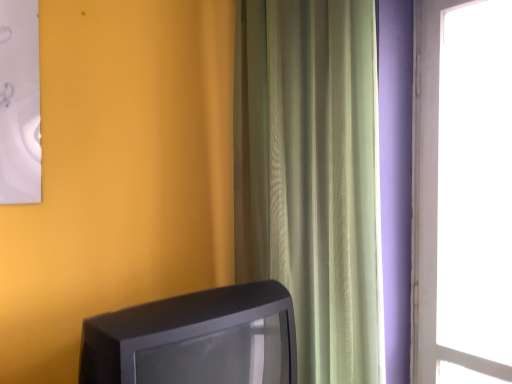
Question: From a real-world perspective, is green textured curtain at center under matte black television at lower left?

Choices:
 (A) yes
 (B) no

Answer: (B)

Question: Can you confirm if green textured curtain at center is positioned to the left of matte black television at lower left?

Choices:
 (A) no
 (B) yes

Answer: (A)

Question: Is green textured curtain at center positioned beyond the bounds of matte black television at lower left?

Choices:
 (A) no
 (B) yes

Answer: (B)

Question: Could matte black television at lower left be considered to be inside green textured curtain at center?

Choices:
 (A) no
 (B) yes

Answer: (A)

Question: Are green textured curtain at center and matte black television at lower left making contact?

Choices:
 (A) yes
 (B) no

Answer: (B)

Question: Does green textured curtain at center have a smaller size compared to matte black television at lower left?

Choices:
 (A) no
 (B) yes

Answer: (A)

Question: Is the position of matte black television at lower left less distant than that of green textured curtain at center?

Choices:
 (A) yes
 (B) no

Answer: (A)

Question: Can you confirm if matte black television at lower left is thinner than green textured curtain at center?

Choices:
 (A) no
 (B) yes

Answer: (A)

Question: Does matte black television at lower left turn towards green textured curtain at center?

Choices:
 (A) no
 (B) yes

Answer: (A)

Question: Is matte black television at lower left further to camera compared to green textured curtain at center?

Choices:
 (A) yes
 (B) no

Answer: (B)

Question: From a real-world perspective, is matte black television at lower left below green textured curtain at center?

Choices:
 (A) no
 (B) yes

Answer: (B)

Question: Is matte black television at lower left to the left of green textured curtain at center from the viewer's perspective?

Choices:
 (A) no
 (B) yes

Answer: (B)

Question: Is green textured curtain at center situated inside matte black television at lower left or outside?

Choices:
 (A) inside
 (B) outside

Answer: (B)